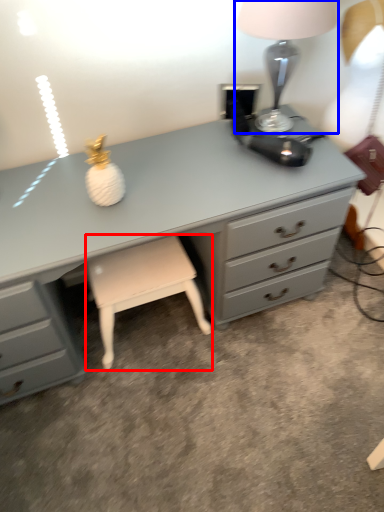
Question: Which point is further to the camera, stool (highlighted by a red box) or table lamp (highlighted by a blue box)?

Choices:
 (A) stool
 (B) table lamp

Answer: (A)